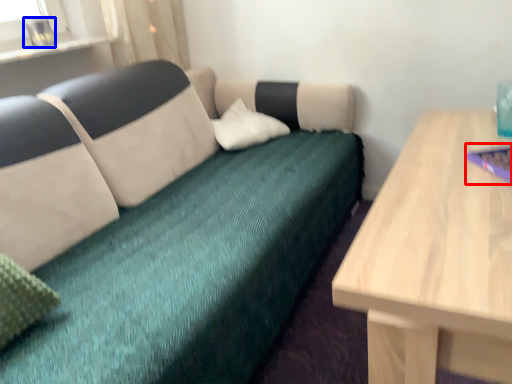
Question: Which object appears closest to the camera in this image, laptop (highlighted by a red box) or glass vase (highlighted by a blue box)?

Choices:
 (A) laptop
 (B) glass vase

Answer: (A)